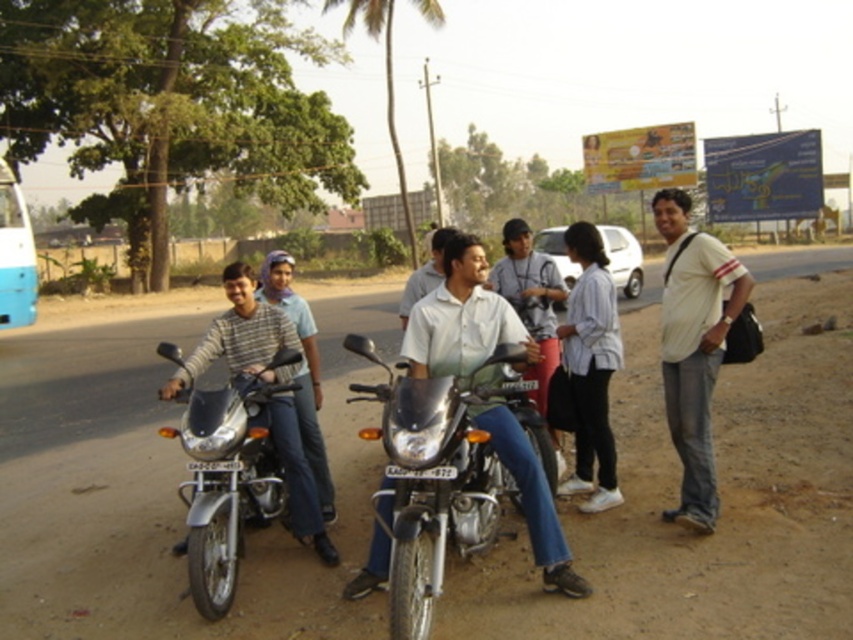
You are a photographer standing at the roadside scene. You want to take a photo of the matte black motorcycle at left and the light blue shirt at center. Which object should you focus on first to ensure both are in sharp focus?

The matte black motorcycle at left is closer to the viewer than the light blue shirt at center. To ensure both are in sharp focus, you should focus on the matte black motorcycle at left first, as it is closer, and the light blue shirt at center will fall within the depth of field.

In the scene shown: You are a delivery person who needs to park your motorcycle between the shiny metallic motorcycle at left and the matte silver motorcycle at center. Can you fit your motorcycle there if your motorcycle is 1.2 meters wide?

The shiny metallic motorcycle at left might be wider than matte silver motorcycle at center, so the space between them is uncertain. You should check the actual width before deciding to park there.

What is the object located at the coordinates point (225, 477)?

The object located at point (225, 477) is the shiny metallic motorcycle at left.